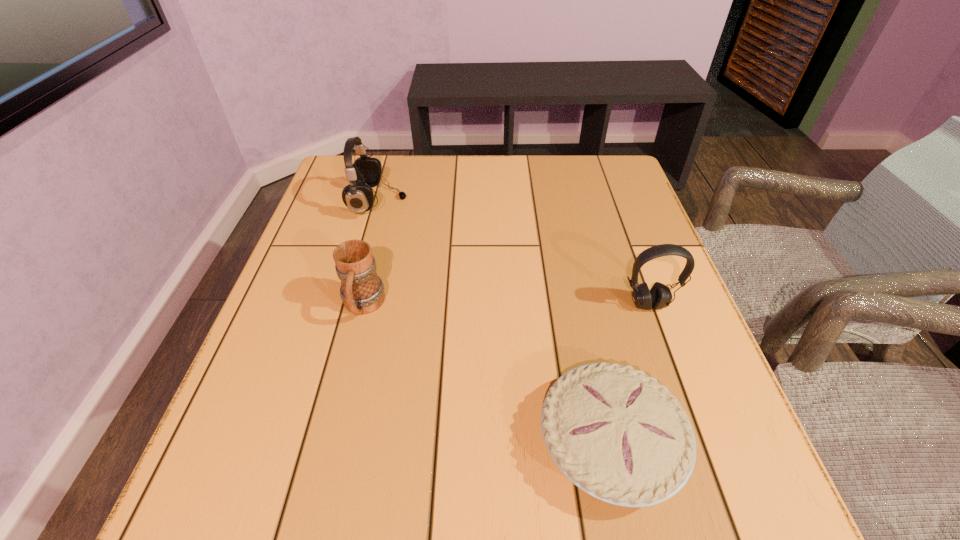
In order to click on vacant position at the right edge of the desktop in this screenshot , I will do `click(680, 291)`.

At what (x,y) coordinates should I click in order to perform the action: click on free space at the far left corner. Please return your answer as a coordinate pair (x, y). Looking at the image, I should click on (338, 167).

The width and height of the screenshot is (960, 540). What are the coordinates of `vacant space at the near left corner of the desktop` in the screenshot? It's located at (289, 494).

What are the coordinates of `free spot at the far right corner of the desktop` in the screenshot? It's located at (616, 164).

Locate an element on the screen. The height and width of the screenshot is (540, 960). free spot between the farthest object and the shortest object is located at coordinates (494, 322).

The image size is (960, 540). Identify the location of blank region between the nearest object and the left headset. [x=494, y=322].

I want to click on free space between the shortest object and the mug, so click(x=487, y=374).

I want to click on free spot between the nearer headset and the second shortest object, so click(506, 305).

At what (x,y) coordinates should I click in order to perform the action: click on vacant region between the left headset and the right headset. Please return your answer as a coordinate pair (x, y). The height and width of the screenshot is (540, 960). Looking at the image, I should click on (514, 253).

Locate an element on the screen. The width and height of the screenshot is (960, 540). unoccupied position between the pie and the second shortest object is located at coordinates (487, 374).